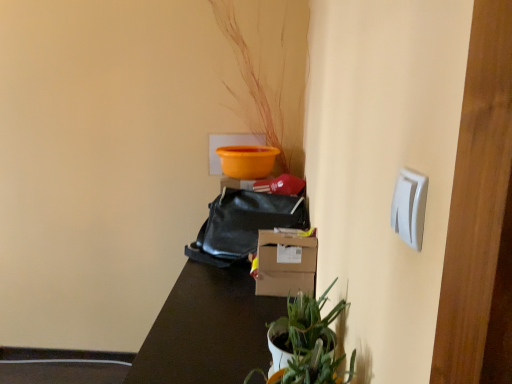
Question: Can you confirm if brown matte table at center is bigger than black leather bag at center?

Choices:
 (A) yes
 (B) no

Answer: (A)

Question: Is black leather bag at center at the back of brown matte table at center?

Choices:
 (A) no
 (B) yes

Answer: (A)

Question: Considering the relative positions of brown matte table at center and black leather bag at center in the image provided, is brown matte table at center to the right of black leather bag at center from the viewer's perspective?

Choices:
 (A) yes
 (B) no

Answer: (B)

Question: Is brown matte table at center smaller than black leather bag at center?

Choices:
 (A) yes
 (B) no

Answer: (B)

Question: Is the position of brown matte table at center more distant than that of black leather bag at center?

Choices:
 (A) yes
 (B) no

Answer: (B)

Question: Is brown matte table at center to the left of black leather bag at center from the viewer's perspective?

Choices:
 (A) no
 (B) yes

Answer: (B)

Question: Considering the relative sizes of black leather bag at center and brown matte table at center in the image provided, is black leather bag at center bigger than brown matte table at center?

Choices:
 (A) no
 (B) yes

Answer: (A)

Question: Is black leather bag at center wider than brown matte table at center?

Choices:
 (A) yes
 (B) no

Answer: (B)

Question: Does black leather bag at center contain brown matte table at center?

Choices:
 (A) no
 (B) yes

Answer: (A)

Question: Is black leather bag at center completely or partially outside of brown matte table at center?

Choices:
 (A) yes
 (B) no

Answer: (A)

Question: Does black leather bag at center have a lesser height compared to brown matte table at center?

Choices:
 (A) yes
 (B) no

Answer: (A)

Question: From the image's perspective, is black leather bag at center located above brown matte table at center?

Choices:
 (A) no
 (B) yes

Answer: (B)

Question: Considering the relative positions of black leather bag at center and white plastic light switch at upper right in the image provided, is black leather bag at center behind white plastic light switch at upper right?

Choices:
 (A) no
 (B) yes

Answer: (B)